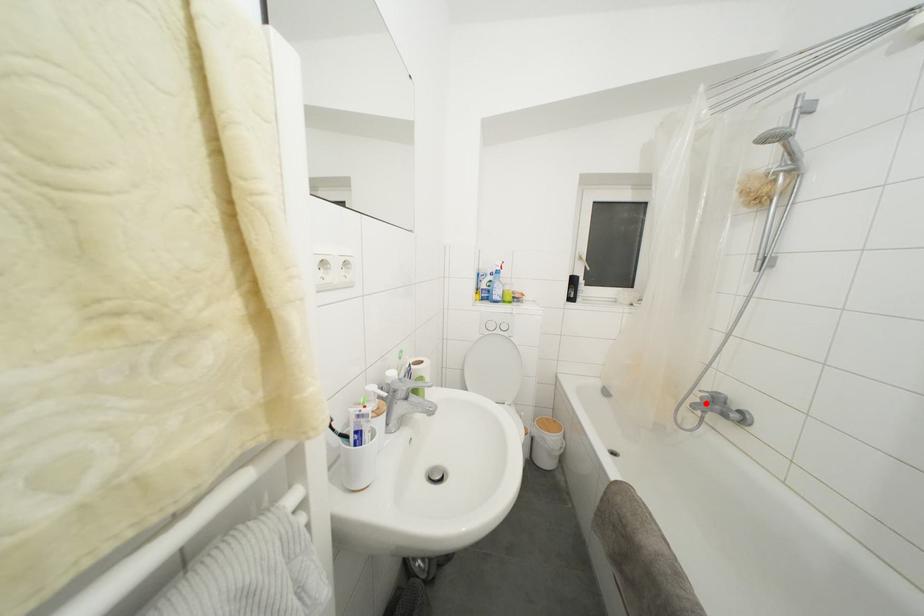
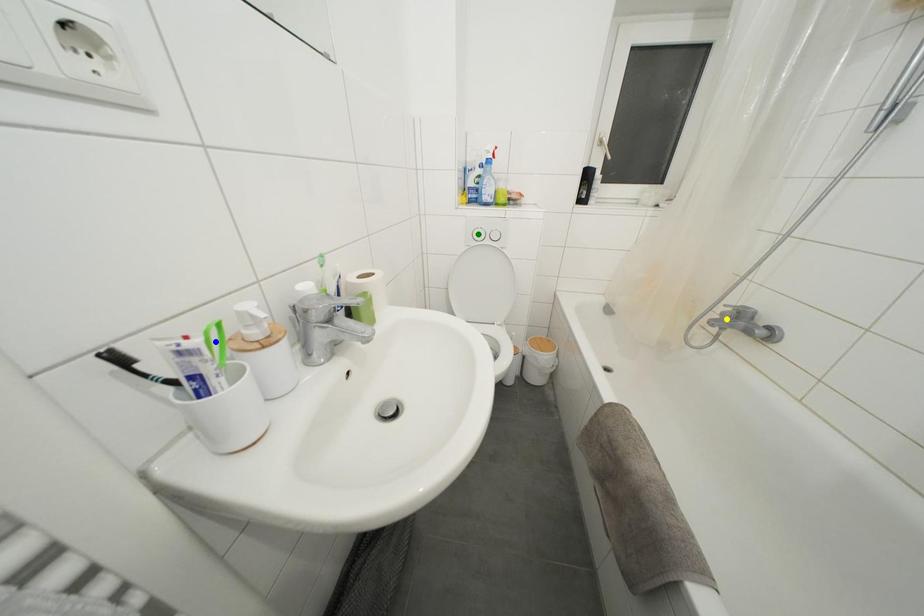
Question: I am providing you with two images of the same scene from different viewpoints. A red point is marked on the first image. You are given multiple points on the second image. Which mark in image 2 goes with the point in image 1?

Choices:
 (A) blue point
 (B) yellow point
 (C) green point

Answer: (B)